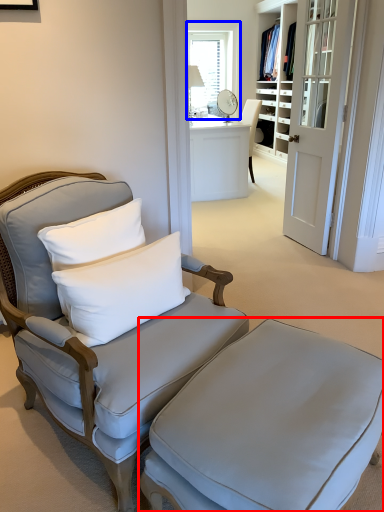
Question: Among these objects, which one is nearest to the camera, table (highlighted by a red box) or window (highlighted by a blue box)?

Choices:
 (A) table
 (B) window

Answer: (A)